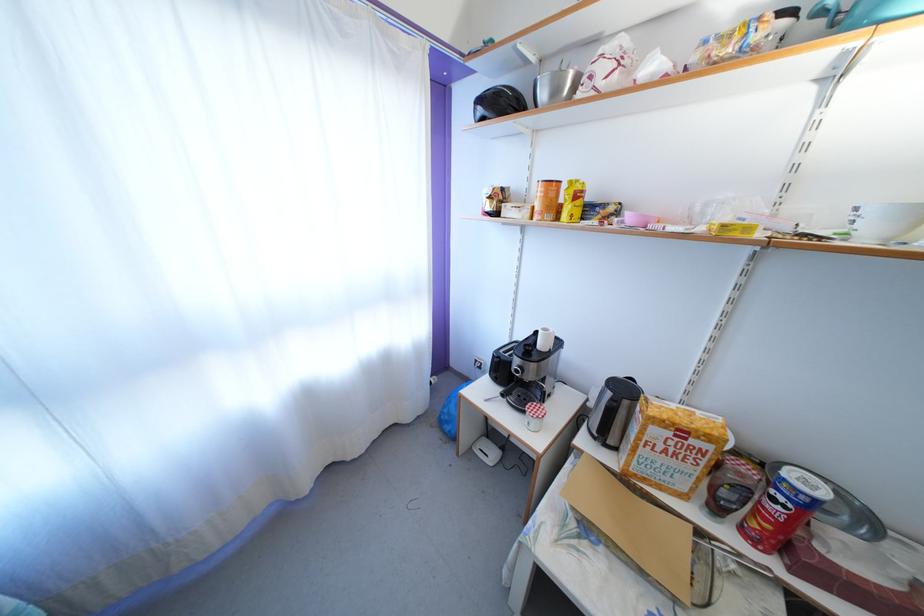
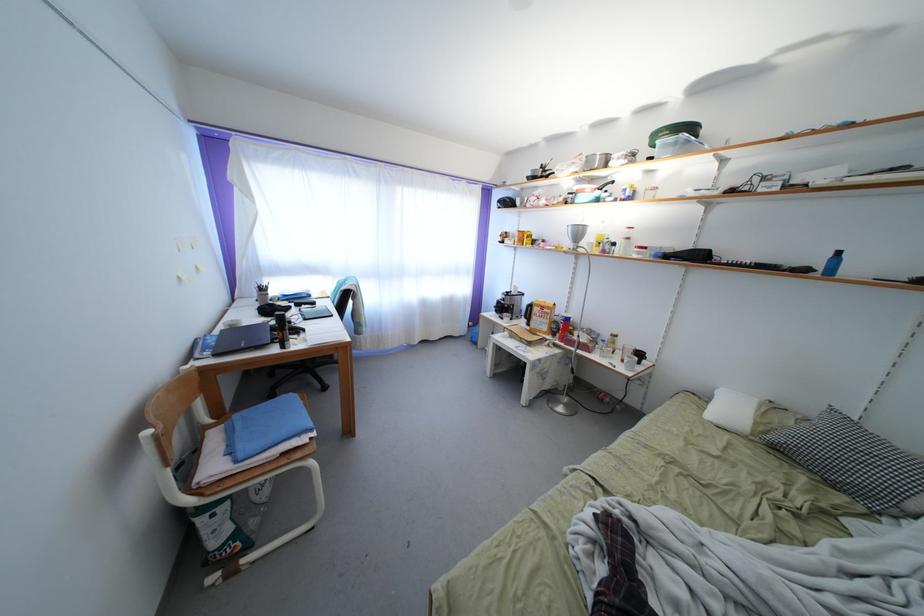
Find the pixel in the second image that matches (x=688, y=428) in the first image.

(549, 310)